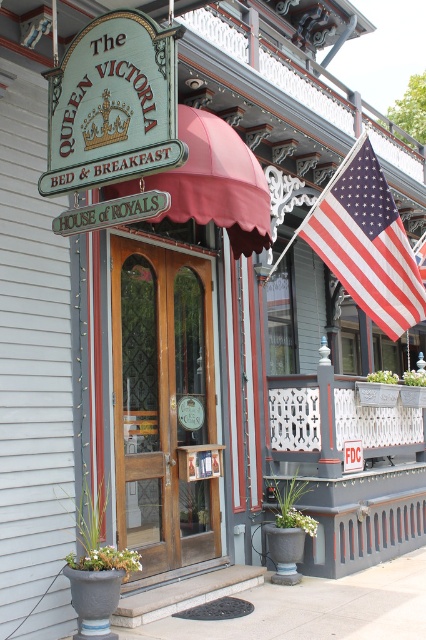
You are standing at the entrance of The Queen Victoria Bed and Breakfast and want to take a photo. You have two points marked on your camera screen at coordinates point (112,353) and point (71,74). Which point is closer to your camera lens?

Point (71,74) is closer to the camera lens because the description states that point (112,353) is further away from the camera than point (71,74).

You are a guest arriving at The Queen Victoria Bed and Breakfast and need to enter the building. You see the mahogany wood door at center and the green painted wood sign at upper left. Which object is wider?

The mahogany wood door at center has a lesser width compared to the green painted wood sign at upper left, so the green painted wood sign at upper left is wider.

You are a guest arriving at The Queen Victoria Bed and Breakfast. You see the american flag at upper right and the white painted wood porch at lower right. Which object is positioned to the left of the other?

The american flag at upper right is positioned to the left of the white painted wood porch at lower right.